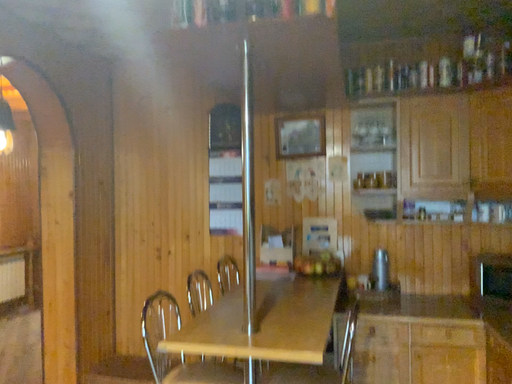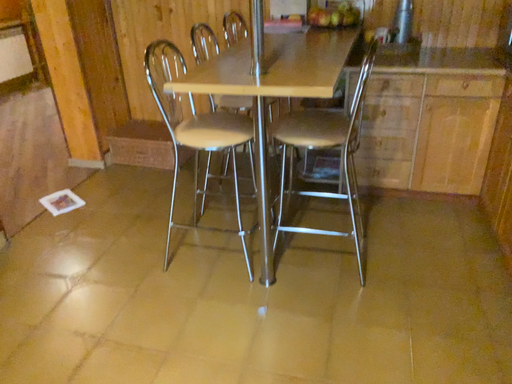
Question: Which way did the camera rotate in the video?

Choices:
 (A) rotated upward
 (B) rotated downward

Answer: (B)